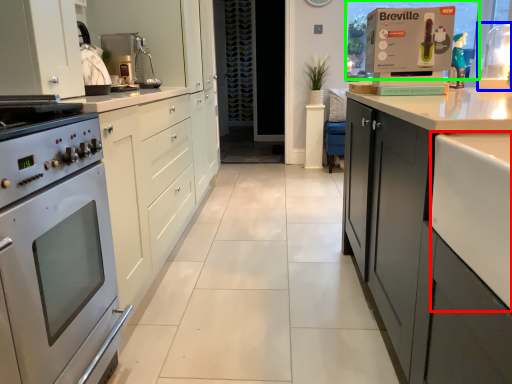
Question: Which is farther away from counter top (highlighted by a red box)? appliance (highlighted by a blue box) or window screen (highlighted by a green box)?

Choices:
 (A) appliance
 (B) window screen

Answer: (A)